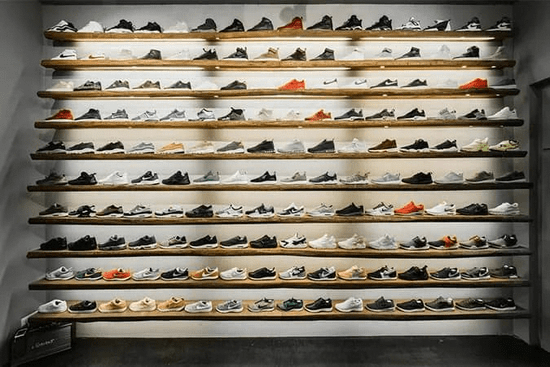
Find the location of a particular element. This screenshot has width=550, height=367. shelves is located at coordinates (126, 316), (129, 284), (126, 252), (124, 220), (132, 185), (131, 156), (134, 122), (135, 93), (136, 62), (140, 35).